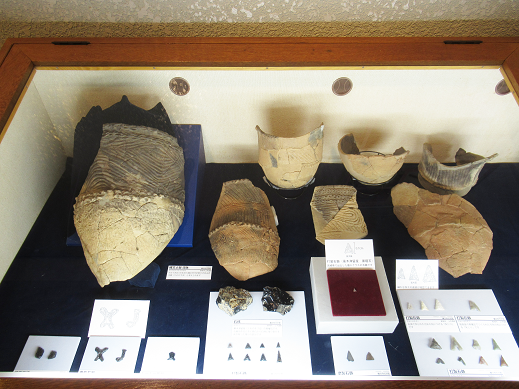
Locate an element on the screen. This screenshot has height=389, width=519. wall shadow from flash is located at coordinates (450, 26).